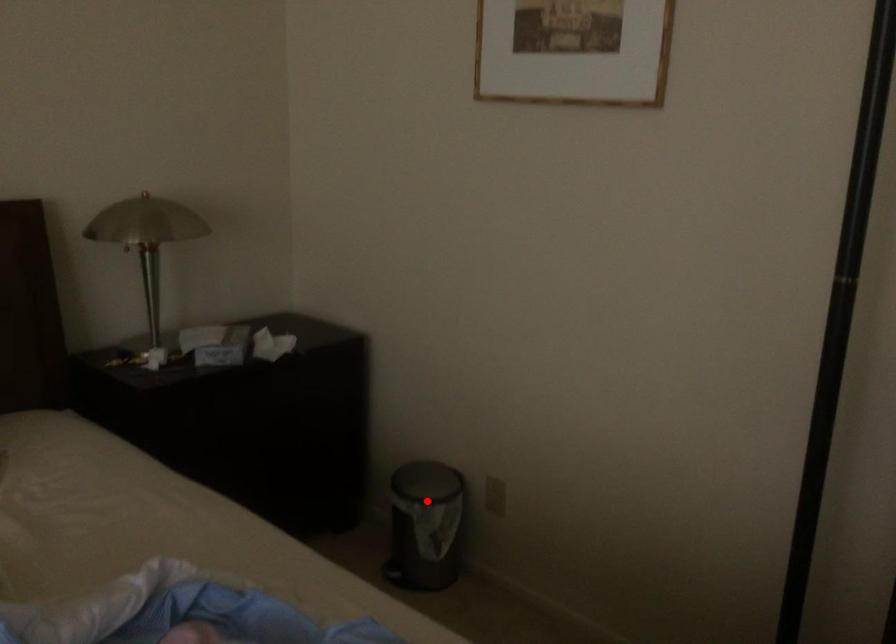
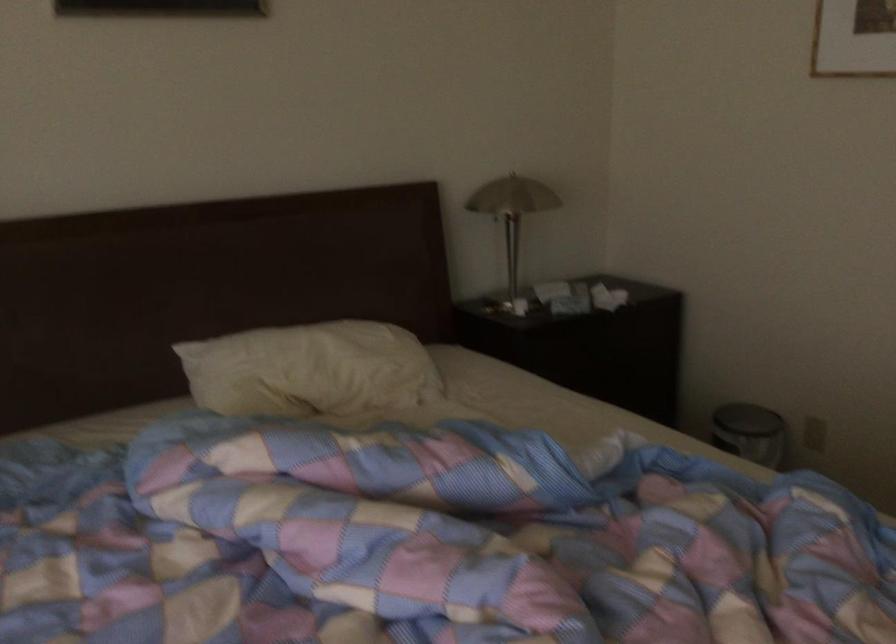
In the second image, find the point that corresponds to the highlighted location in the first image.

(748, 431)